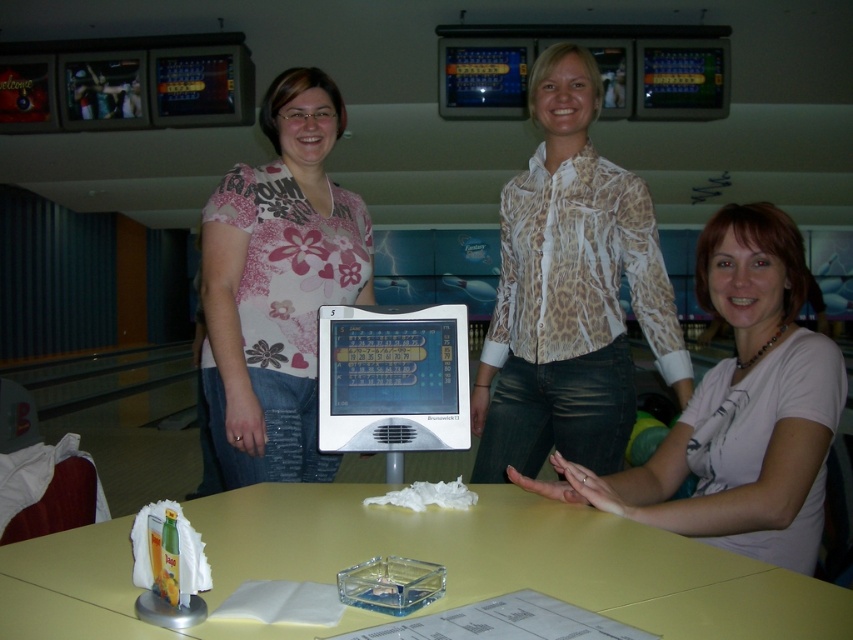
Question: From the image, what is the correct spatial relationship of leopard print blouse at center in relation to pink floral shirt at center?

Choices:
 (A) above
 (B) below

Answer: (A)

Question: Can you confirm if yellow matte table at center is thinner than white matte shirt at center?

Choices:
 (A) yes
 (B) no

Answer: (B)

Question: Can you confirm if leopard print blouse at center is positioned below pink floral shirt at center?

Choices:
 (A) yes
 (B) no

Answer: (B)

Question: Which point is closer to the camera taking this photo?

Choices:
 (A) (589, 282)
 (B) (419, 612)
 (C) (271, 401)

Answer: (B)

Question: Which of the following is the farthest from the observer?

Choices:
 (A) leopard print blouse at center
 (B) pink floral shirt at center
 (C) yellow matte table at center

Answer: (B)

Question: Among these points, which one is nearest to the camera?

Choices:
 (A) (305, 296)
 (B) (735, 305)

Answer: (B)